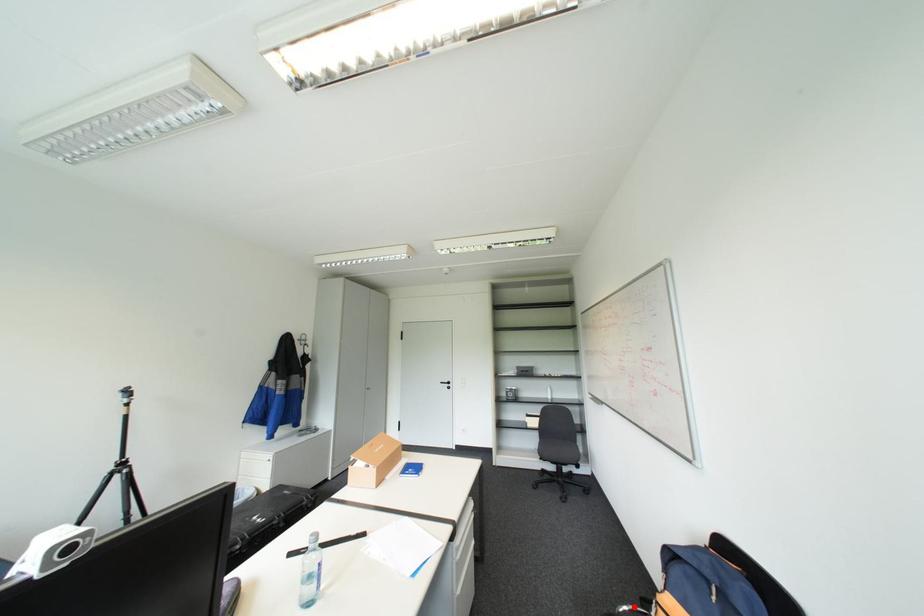
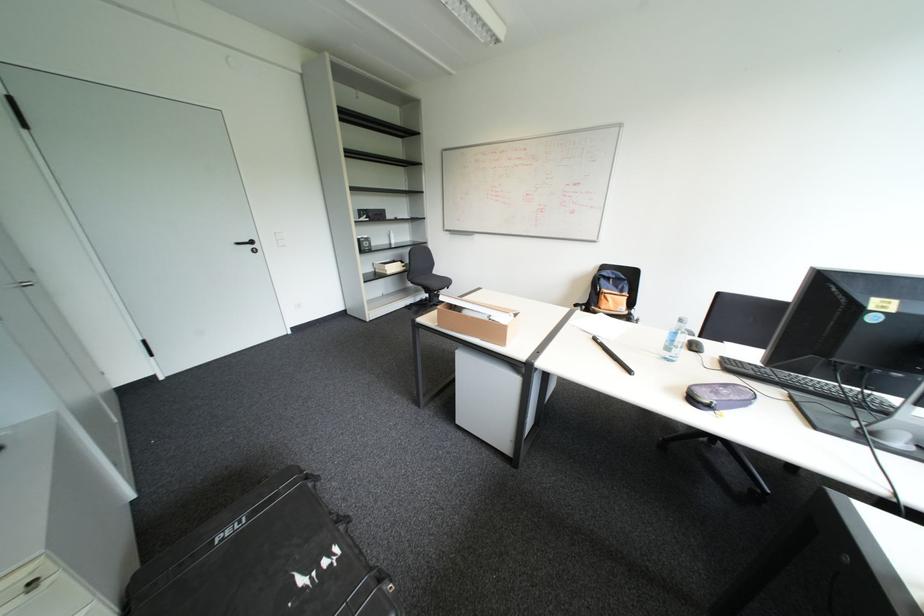
Question: I am providing you with two images of the same scene from different viewpoints. A red point is marked on the first image. Can you still see the location of the red point in image 2?

Choices:
 (A) Yes
 (B) No

Answer: (B)